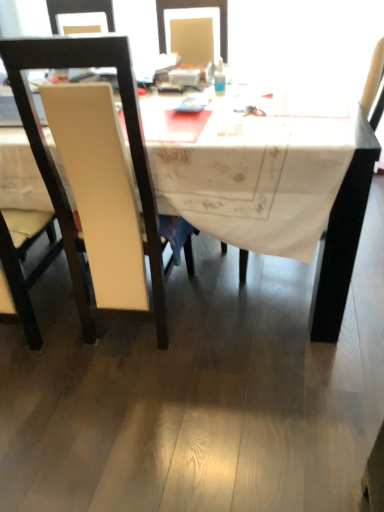
Question: Considering the relative positions of white leather chair at left, positioned as the 2th chair in left-to-right order, and white fabric table at center in the image provided, is white leather chair at left, positioned as the 2th chair in left-to-right order, to the left or to the right of white fabric table at center?

Choices:
 (A) right
 (B) left

Answer: (A)

Question: Which is correct: white leather chair at left, placed as the first chair when sorted from right to left, is inside white fabric table at center, or outside of it?

Choices:
 (A) outside
 (B) inside

Answer: (B)

Question: Which is nearer to the white fabric table at center?

Choices:
 (A) white matte chair at left, the first chair in the left-to-right sequence
 (B) white leather chair at left, positioned as the 2th chair in left-to-right order
 (C) translucent plastic bottle at upper center

Answer: (B)

Question: Which object is positioned closest to the white fabric table at center?

Choices:
 (A) white leather chair at left, placed as the first chair when sorted from right to left
 (B) translucent plastic bottle at upper center
 (C) white matte chair at left, the first chair in the left-to-right sequence

Answer: (A)